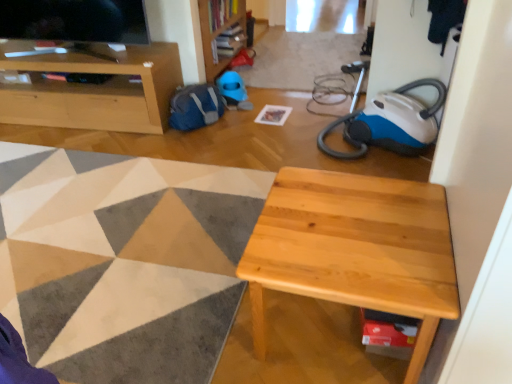
This screenshot has height=384, width=512. I want to click on vacant area situated to the left side of natural wood table at center, so click(x=202, y=327).